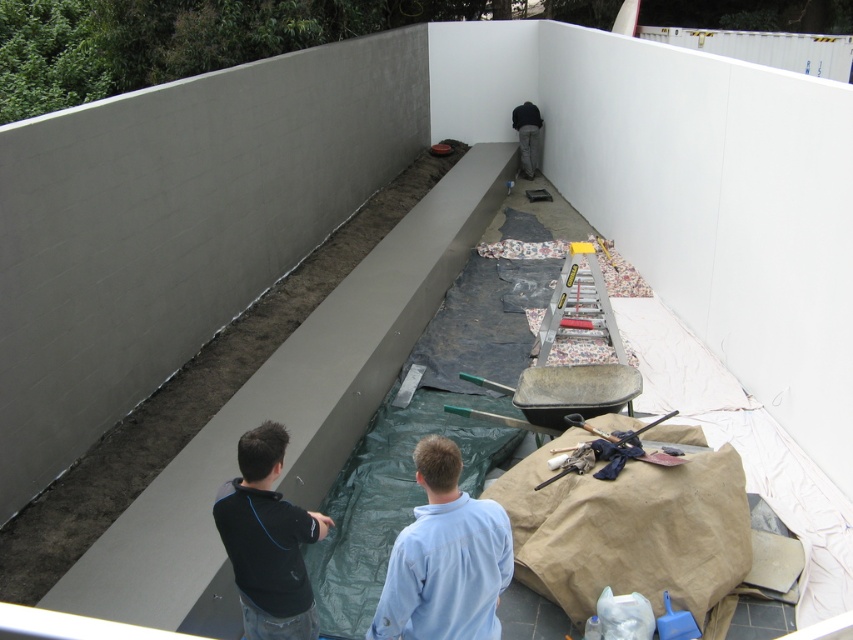
Question: Is light blue shirt at center bigger than black matte shirt at lower left?

Choices:
 (A) no
 (B) yes

Answer: (B)

Question: Estimate the real-world distances between objects in this image. Which object is farther from the black matte shirt at lower left?

Choices:
 (A) light blue shirt at center
 (B) dark gray pants at center

Answer: (B)

Question: Does light blue shirt at center have a lesser width compared to dark gray pants at center?

Choices:
 (A) no
 (B) yes

Answer: (A)

Question: Which of the following is the farthest from the observer?

Choices:
 (A) (519, 115)
 (B) (445, 548)

Answer: (A)

Question: Which of the following is the farthest from the observer?

Choices:
 (A) light blue shirt at center
 (B) black matte shirt at lower left
 (C) dark gray pants at center

Answer: (C)

Question: Is light blue shirt at center further to camera compared to black matte shirt at lower left?

Choices:
 (A) yes
 (B) no

Answer: (B)